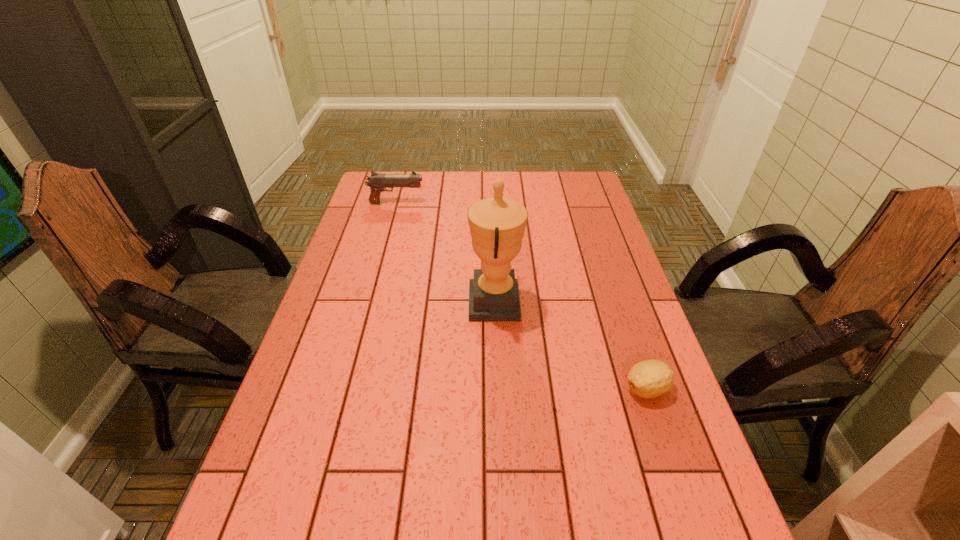
In order to click on free space between the lemon and the gun in this screenshot , I will do tap(521, 296).

Locate an element on the screen. The image size is (960, 540). vacant space that's between the lemon and the gun is located at coordinates (521, 296).

At what (x,y) coordinates should I click in order to perform the action: click on unoccupied area between the rightmost object and the award. Please return your answer as a coordinate pair (x, y). Looking at the image, I should click on pos(571,345).

Where is `free point between the farthest object and the second object from right to left`? Image resolution: width=960 pixels, height=540 pixels. free point between the farthest object and the second object from right to left is located at coordinates (445, 252).

At what (x,y) coordinates should I click in order to perform the action: click on object that is the closest to the award. Please return your answer as a coordinate pair (x, y). This screenshot has width=960, height=540. Looking at the image, I should click on (648, 379).

Identify which object is located as the nearest to the nearest object. Please provide its 2D coordinates. Your answer should be formatted as a tuple, i.e. [(x, y)], where the tuple contains the x and y coordinates of a point satisfying the conditions above.

[(497, 225)]